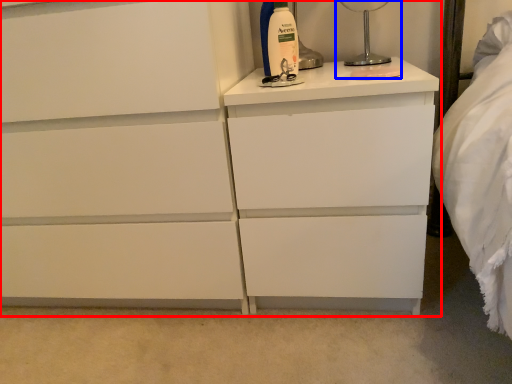
Question: Which point is further to the camera, chest of drawers (highlighted by a red box) or bedside lamp (highlighted by a blue box)?

Choices:
 (A) chest of drawers
 (B) bedside lamp

Answer: (B)